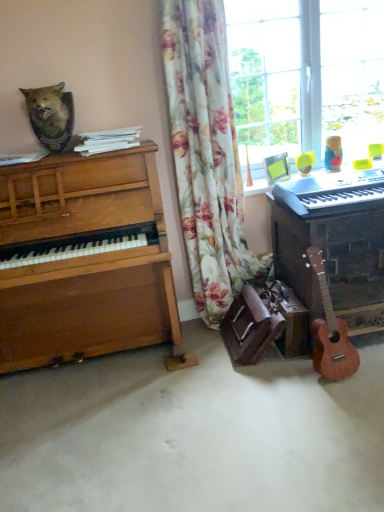
I want to click on vacant location below rustic wooden plaque at upper left (from a real-world perspective), so click(52, 155).